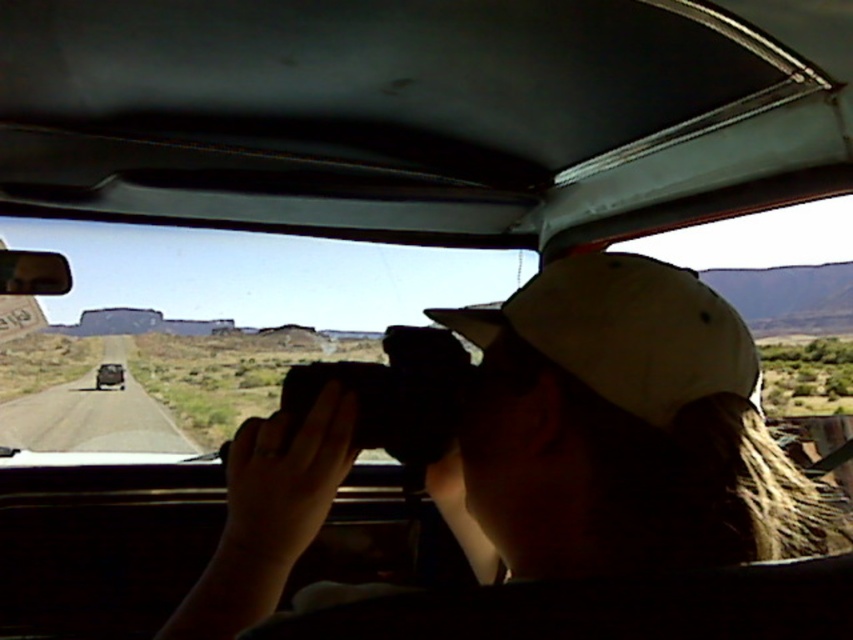
Question: Which object is positioned farthest from the black rubber car at left?

Choices:
 (A) white matte baseball hat at center
 (B) black matte camera at center
 (C) transparent glass car window at center

Answer: (A)

Question: Is white matte baseball hat at center to the right of black matte camera at center from the viewer's perspective?

Choices:
 (A) no
 (B) yes

Answer: (B)

Question: Where is white matte baseball hat at center located in relation to black rubber car at left in the image?

Choices:
 (A) above
 (B) below

Answer: (A)

Question: Which is farther from the black rubber car at left?

Choices:
 (A) white matte baseball hat at center
 (B) black matte camera at center

Answer: (A)

Question: Which point is farther to the camera?

Choices:
 (A) black rubber car at left
 (B) white matte baseball hat at center

Answer: (A)

Question: Can you confirm if white matte baseball hat at center is positioned below black matte camera at center?

Choices:
 (A) yes
 (B) no

Answer: (B)